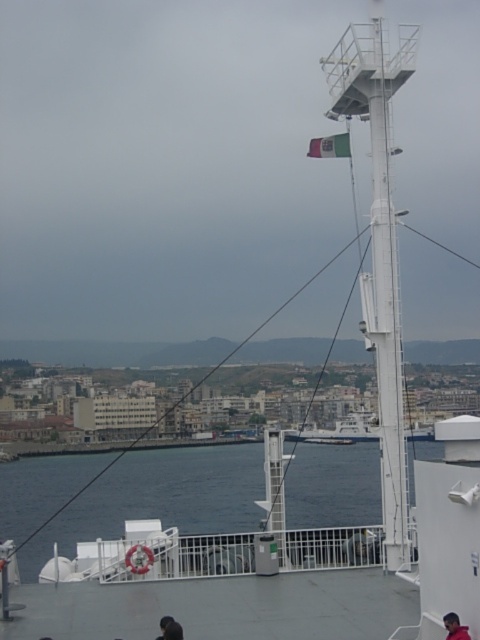
Question: Estimate the real-world distances between objects in this image. Which object is farther from the white metallic mast at upper center?

Choices:
 (A) white fabric flag at upper center
 (B) blue water at center
 (C) dark hair at lower center
 (D) red fabric head at upper right

Answer: (B)

Question: Where is white metallic mast at upper center located in relation to red fabric head at upper right in the image?

Choices:
 (A) left
 (B) right

Answer: (B)

Question: Is white fabric flag at upper center thinner than red fabric head at upper right?

Choices:
 (A) yes
 (B) no

Answer: (B)

Question: Which is nearer to the dark hair at lower center?

Choices:
 (A) white fabric flag at upper center
 (B) white metallic mast at upper center
 (C) blue water at center

Answer: (B)

Question: Is red fabric head at upper right thinner than dark hair at lower center?

Choices:
 (A) no
 (B) yes

Answer: (B)

Question: Which of these objects is positioned farthest from the red fabric head at upper right?

Choices:
 (A) blue water at center
 (B) dark hair at lower center
 (C) white fabric flag at upper center

Answer: (A)